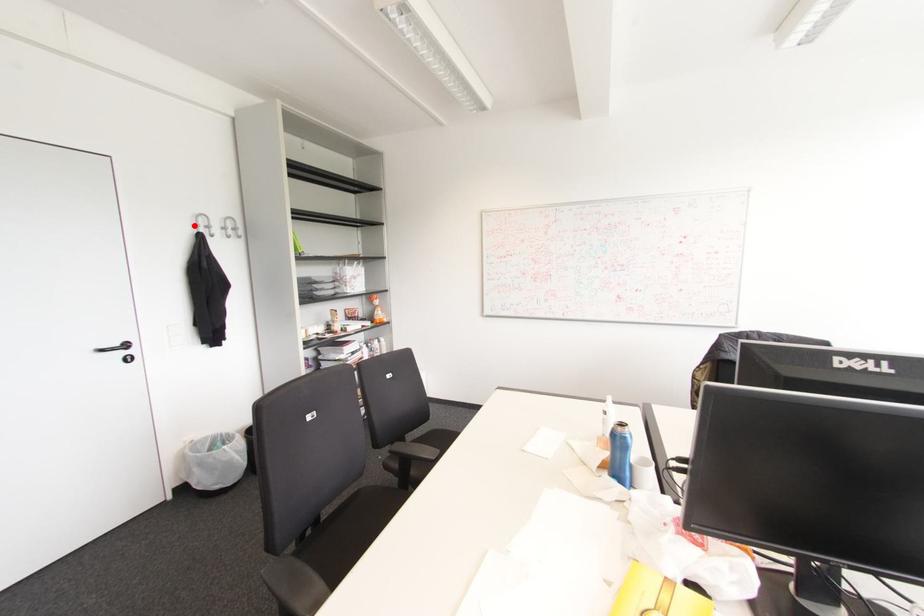
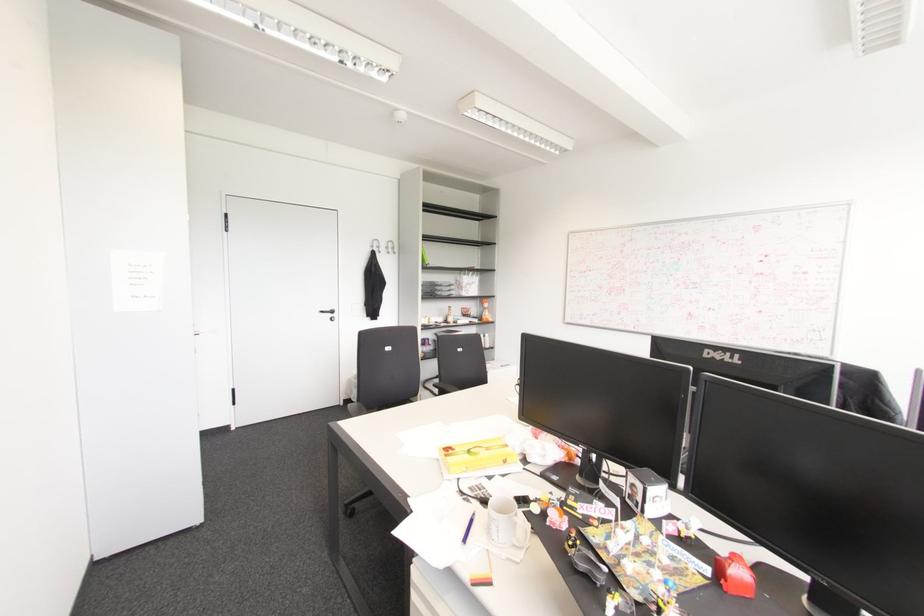
The point at the highlighted location is marked in the first image. Where is the corresponding point in the second image?

(371, 246)